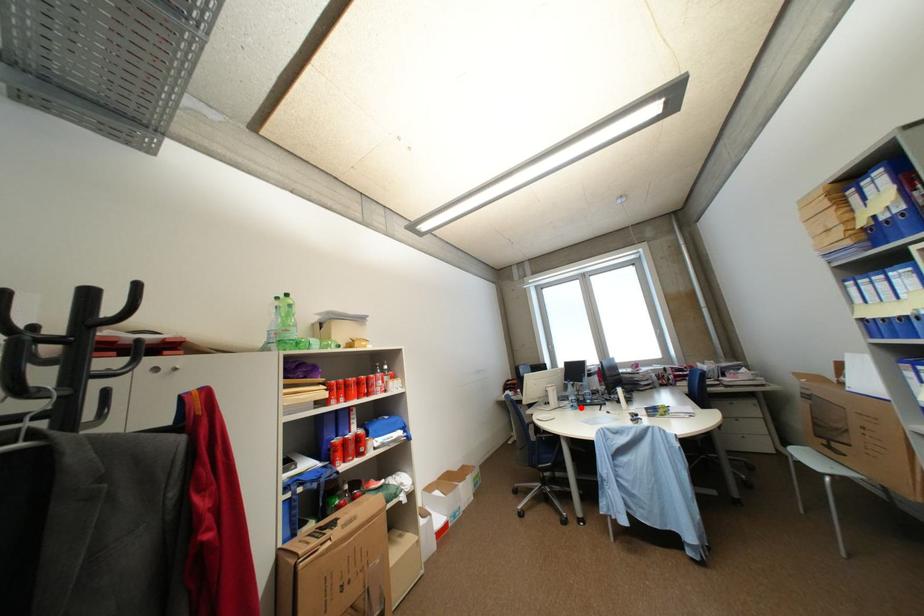
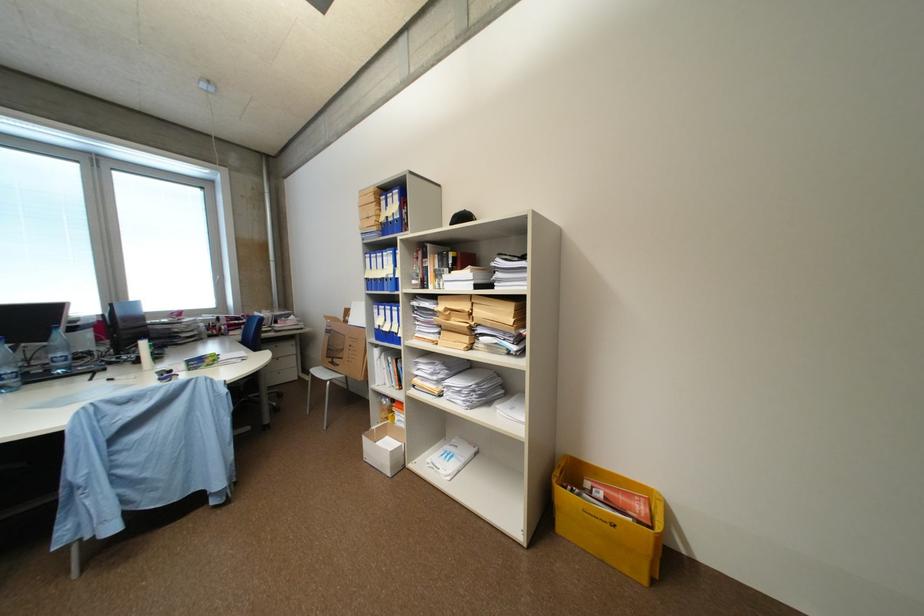
Question: I am providing you with two images of the same scene from different viewpoints. A red point is shown in image1. For the corresponding object point in image2, is it positioned nearer or farther from the camera?

Choices:
 (A) Nearer
 (B) Farther

Answer: (A)